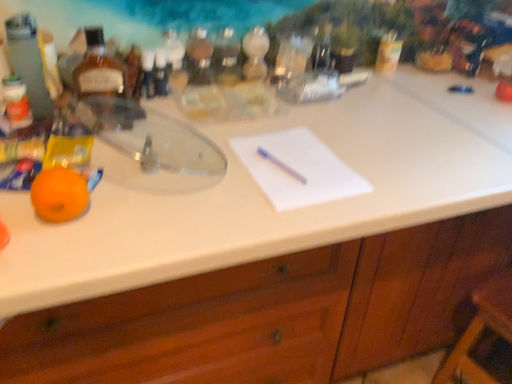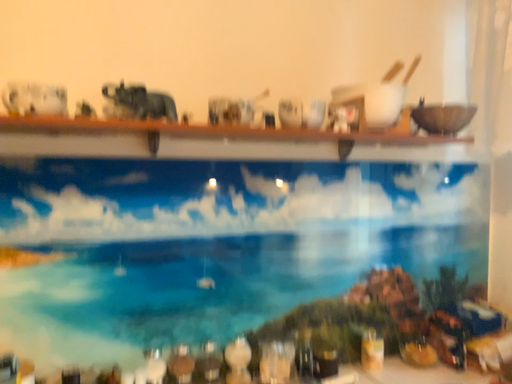
Question: How did the camera likely rotate when shooting the video?

Choices:
 (A) rotated upward
 (B) rotated downward

Answer: (A)